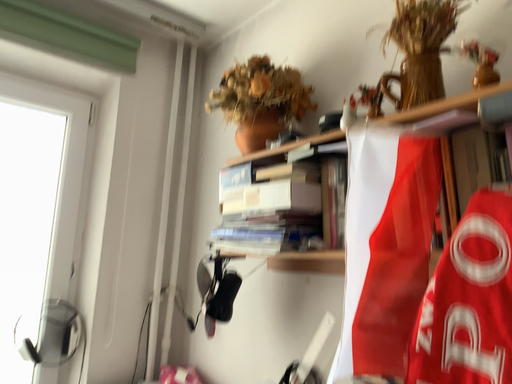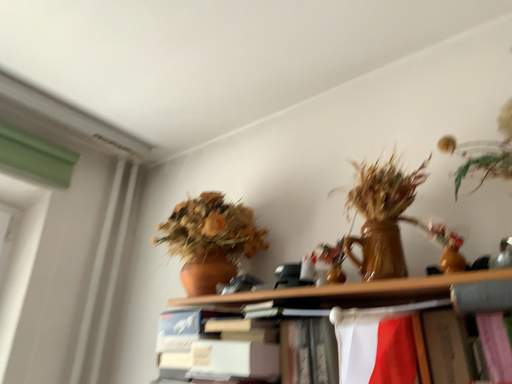
Question: How did the camera likely rotate when shooting the video?

Choices:
 (A) rotated downward
 (B) rotated upward

Answer: (B)